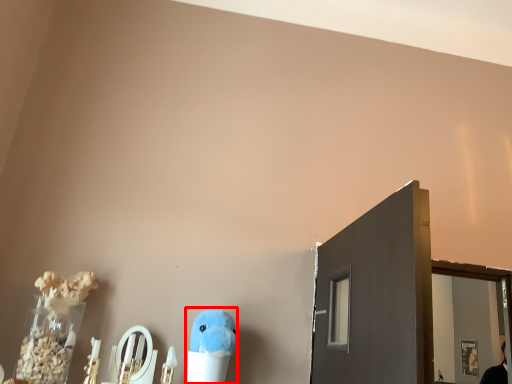
Question: From the image's perspective, where is toy (annotated by the red box) located in relation to mirror in the image?

Choices:
 (A) below
 (B) above

Answer: (A)